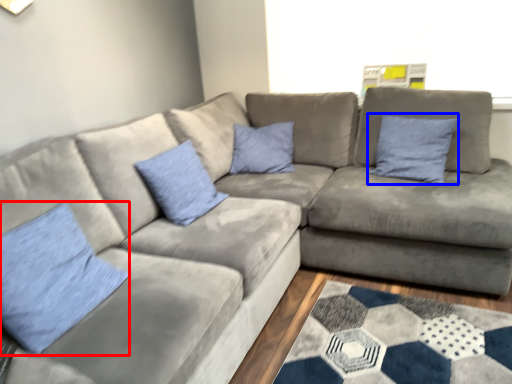
Question: Among these objects, which one is nearest to the camera, pillow (highlighted by a red box) or pillow (highlighted by a blue box)?

Choices:
 (A) pillow
 (B) pillow

Answer: (A)